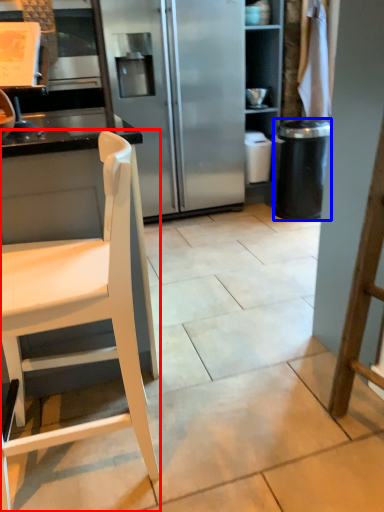
Question: Which point is further to the camera, chair (highlighted by a red box) or trash bin/can (highlighted by a blue box)?

Choices:
 (A) chair
 (B) trash bin/can

Answer: (B)